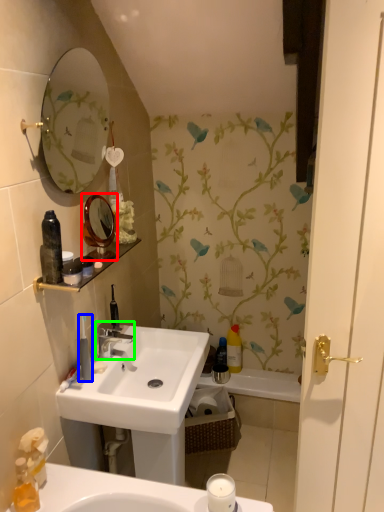
Question: Estimate the real-world distances between objects in this image. Which object is farther from mirror (highlighted by a red box), toiletry (highlighted by a blue box) or tap (highlighted by a green box)?

Choices:
 (A) toiletry
 (B) tap

Answer: (B)